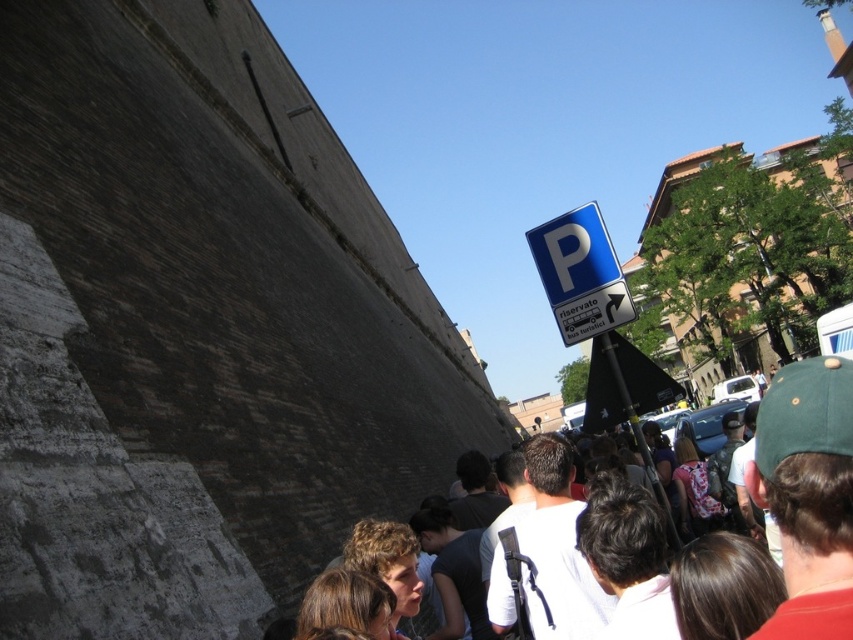
Question: Among these objects, which one is nearest to the camera?

Choices:
 (A) brown hair at center
 (B) blue plastic parking sign at upper right

Answer: (A)

Question: Is brown hair at center bigger than blue plastic parking sign at upper right?

Choices:
 (A) no
 (B) yes

Answer: (A)

Question: Does brown hair at center have a smaller size compared to blue plastic parking sign at upper right?

Choices:
 (A) no
 (B) yes

Answer: (B)

Question: Among these objects, which one is farthest from the camera?

Choices:
 (A) brown hair at center
 (B) blue plastic parking sign at upper right

Answer: (B)

Question: Is brown hair at center to the right of blue plastic parking sign at upper right from the viewer's perspective?

Choices:
 (A) yes
 (B) no

Answer: (A)

Question: Which of the following is the farthest from the observer?

Choices:
 (A) (798, 372)
 (B) (548, 280)

Answer: (B)